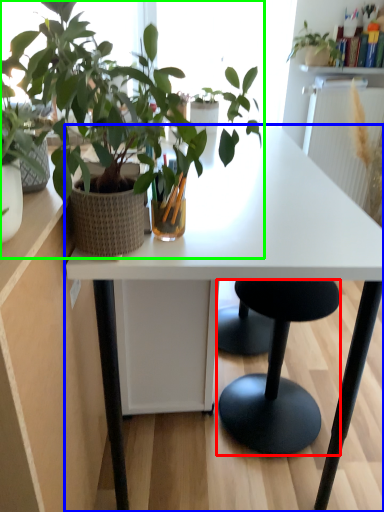
Question: Which is farther away from stool (highlighted by a red box)? desk (highlighted by a blue box) or houseplant (highlighted by a green box)?

Choices:
 (A) desk
 (B) houseplant

Answer: (B)